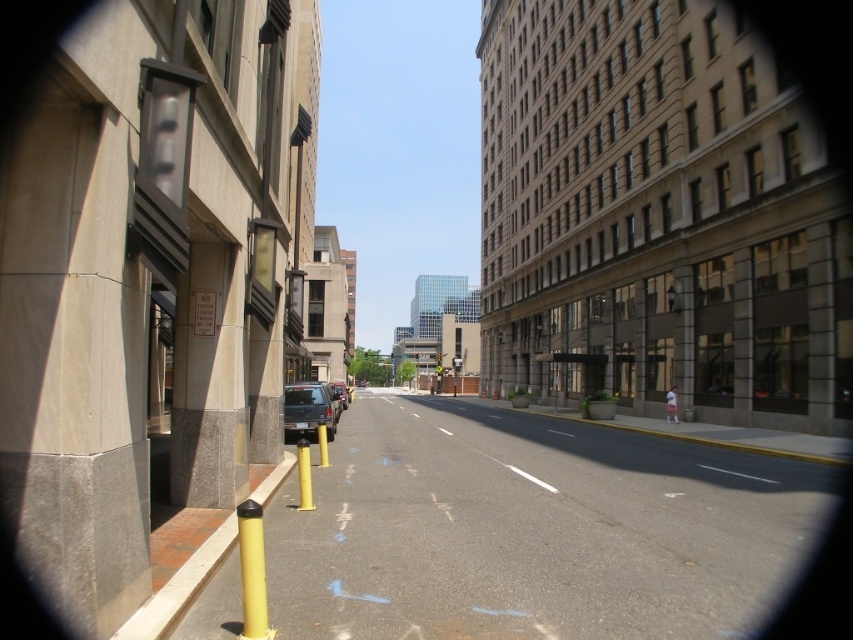
You are a delivery person standing on the sidewalk and need to place a package on the yellow asphalt at lower left. However, there is a yellow rubber pole at center in the way. Can you move the pole to access the asphalt?

The yellow asphalt at lower left is positioned under the yellow rubber pole at center, so the pole is blocking direct access to the asphalt. You would need to move the pole to reach the asphalt.

You are a delivery robot navigating a city street. You need to move from your current position to a delivery point located at point (318, 394). There is an obstacle at point (303, 497). Will you have to go around the obstacle to reach your destination?

Yes, you will have to go around the obstacle at point (303, 497) because point (318, 394) is behind it, meaning the obstacle is blocking the direct path to the destination.